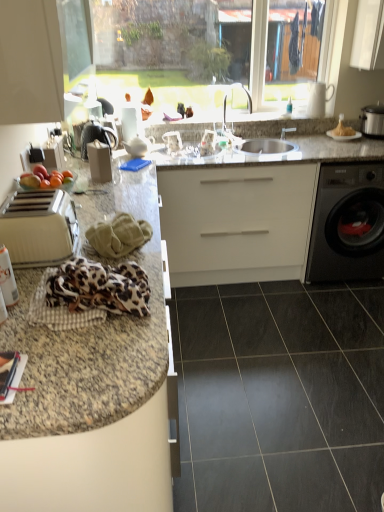
Question: Is green fabric at center, the second material in the front-to-back sequence, positioned with its back to silver metallic faucet at center?

Choices:
 (A) yes
 (B) no

Answer: (B)

Question: Does green fabric at center, the second material in the front-to-back sequence, have a lesser width compared to silver metallic faucet at center?

Choices:
 (A) yes
 (B) no

Answer: (A)

Question: Can you confirm if green fabric at center, the second material in the front-to-back sequence, is positioned to the left of silver metallic faucet at center?

Choices:
 (A) yes
 (B) no

Answer: (A)

Question: From a real-world perspective, is green fabric at center, the second material in the front-to-back sequence, on silver metallic faucet at center?

Choices:
 (A) no
 (B) yes

Answer: (A)

Question: Is green fabric at center, the 1th material when ordered from back to front, further to camera compared to silver metallic faucet at center?

Choices:
 (A) yes
 (B) no

Answer: (B)

Question: Is point (59, 196) positioned closer to the camera than point (223, 117)?

Choices:
 (A) farther
 (B) closer

Answer: (B)

Question: From a real-world perspective, is beige plastic toaster at left physically located above or below silver metallic faucet at center?

Choices:
 (A) below
 (B) above

Answer: (A)

Question: Considering the positions of beige plastic toaster at left and silver metallic faucet at center in the image, is beige plastic toaster at left wider or thinner than silver metallic faucet at center?

Choices:
 (A) thin
 (B) wide

Answer: (A)

Question: Is beige plastic toaster at left spatially inside silver metallic faucet at center, or outside of it?

Choices:
 (A) outside
 (B) inside

Answer: (A)

Question: From a real-world perspective, is white glossy plate at upper right above or below black glossy washing machine at right?

Choices:
 (A) below
 (B) above

Answer: (B)

Question: From the image's perspective, is white glossy plate at upper right above or below black glossy washing machine at right?

Choices:
 (A) below
 (B) above

Answer: (B)

Question: Is point (332, 131) positioned closer to the camera than point (342, 243)?

Choices:
 (A) closer
 (B) farther

Answer: (B)

Question: Relative to black glossy washing machine at right, is white glossy plate at upper right in front or behind?

Choices:
 (A) behind
 (B) front

Answer: (A)

Question: Is satin silver slow cooker at right spatially inside satin silver sink at center, or outside of it?

Choices:
 (A) inside
 (B) outside

Answer: (B)

Question: Looking at their shapes, would you say satin silver slow cooker at right is wider or thinner than satin silver sink at center?

Choices:
 (A) wide
 (B) thin

Answer: (B)